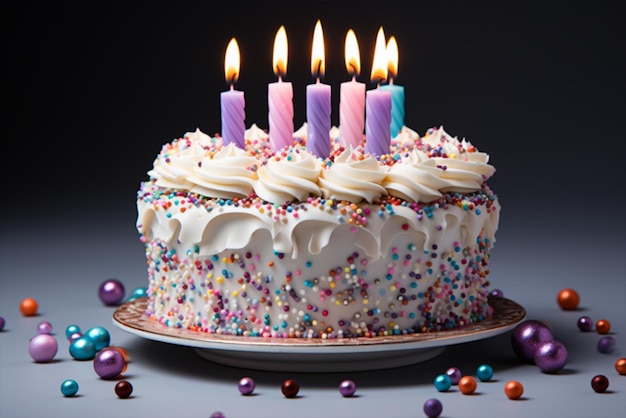
Find the location of a particular element. This screenshot has height=418, width=626. candle is located at coordinates (238, 113), (284, 113), (327, 117), (352, 116), (377, 115), (399, 102).